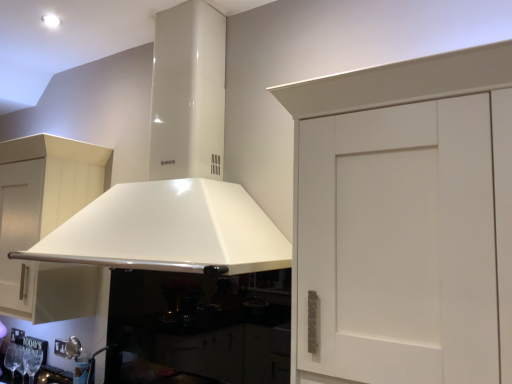
Question: Is white glossy exhaust hood at center touching matte white cabinet at left?

Choices:
 (A) yes
 (B) no

Answer: (B)

Question: Is matte white cabinet at left completely or partially inside white glossy exhaust hood at center?

Choices:
 (A) no
 (B) yes

Answer: (A)

Question: Is white glossy exhaust hood at center positioned far away from matte white cabinet at left?

Choices:
 (A) yes
 (B) no

Answer: (B)

Question: Considering the relative sizes of white glossy exhaust hood at center and matte white cabinet at left in the image provided, is white glossy exhaust hood at center shorter than matte white cabinet at left?

Choices:
 (A) no
 (B) yes

Answer: (A)

Question: Does white glossy exhaust hood at center have a greater width compared to matte white cabinet at left?

Choices:
 (A) yes
 (B) no

Answer: (A)

Question: Is white glossy exhaust hood at center positioned beyond the bounds of matte white cabinet at left?

Choices:
 (A) no
 (B) yes

Answer: (B)

Question: Considering the relative positions of matte white cabinet at left and white glossy exhaust hood at center in the image provided, is matte white cabinet at left in front of white glossy exhaust hood at center?

Choices:
 (A) yes
 (B) no

Answer: (B)

Question: Could white glossy exhaust hood at center be considered to be inside matte white cabinet at left?

Choices:
 (A) no
 (B) yes

Answer: (A)

Question: Is matte white cabinet at left further to camera compared to white glossy exhaust hood at center?

Choices:
 (A) no
 (B) yes

Answer: (B)

Question: Is matte white cabinet at left looking in the opposite direction of white glossy exhaust hood at center?

Choices:
 (A) yes
 (B) no

Answer: (B)

Question: Is matte white cabinet at left bigger than white glossy exhaust hood at center?

Choices:
 (A) no
 (B) yes

Answer: (A)

Question: Considering the relative positions of matte white cabinet at left and white glossy exhaust hood at center in the image provided, is matte white cabinet at left to the right of white glossy exhaust hood at center from the viewer's perspective?

Choices:
 (A) no
 (B) yes

Answer: (A)

Question: From the image's perspective, relative to matte white cabinet at left, is white glossy exhaust hood at center above or below?

Choices:
 (A) below
 (B) above

Answer: (B)